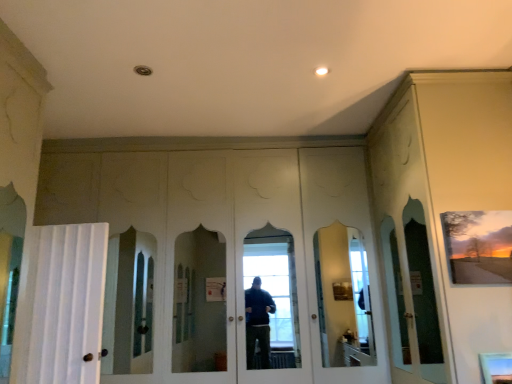
Question: Is matte wooden picture frame at upper right bigger than white fabric curtain at left?

Choices:
 (A) no
 (B) yes

Answer: (A)

Question: Considering the relative sizes of matte wooden picture frame at upper right and white fabric curtain at left in the image provided, is matte wooden picture frame at upper right thinner than white fabric curtain at left?

Choices:
 (A) no
 (B) yes

Answer: (B)

Question: Does matte wooden picture frame at upper right have a smaller size compared to white fabric curtain at left?

Choices:
 (A) no
 (B) yes

Answer: (B)

Question: Can you confirm if matte wooden picture frame at upper right is taller than white fabric curtain at left?

Choices:
 (A) yes
 (B) no

Answer: (B)

Question: Are matte wooden picture frame at upper right and white fabric curtain at left far apart?

Choices:
 (A) no
 (B) yes

Answer: (B)

Question: Is matte wooden picture frame at upper right looking in the opposite direction of white fabric curtain at left?

Choices:
 (A) yes
 (B) no

Answer: (B)

Question: Considering the relative sizes of matte glass window at lower right and white fabric curtain at left in the image provided, is matte glass window at lower right thinner than white fabric curtain at left?

Choices:
 (A) no
 (B) yes

Answer: (B)

Question: Can you confirm if matte glass window at lower right is wider than white fabric curtain at left?

Choices:
 (A) yes
 (B) no

Answer: (B)

Question: From a real-world perspective, is matte glass window at lower right over white fabric curtain at left?

Choices:
 (A) no
 (B) yes

Answer: (A)

Question: Is matte glass window at lower right shorter than white fabric curtain at left?

Choices:
 (A) yes
 (B) no

Answer: (A)

Question: Does matte glass window at lower right come in front of white fabric curtain at left?

Choices:
 (A) yes
 (B) no

Answer: (A)

Question: Is matte glass window at lower right positioned with its back to white fabric curtain at left?

Choices:
 (A) no
 (B) yes

Answer: (A)

Question: Considering the relative sizes of white fabric curtain at left and matte glass window at lower right in the image provided, is white fabric curtain at left wider than matte glass window at lower right?

Choices:
 (A) yes
 (B) no

Answer: (A)